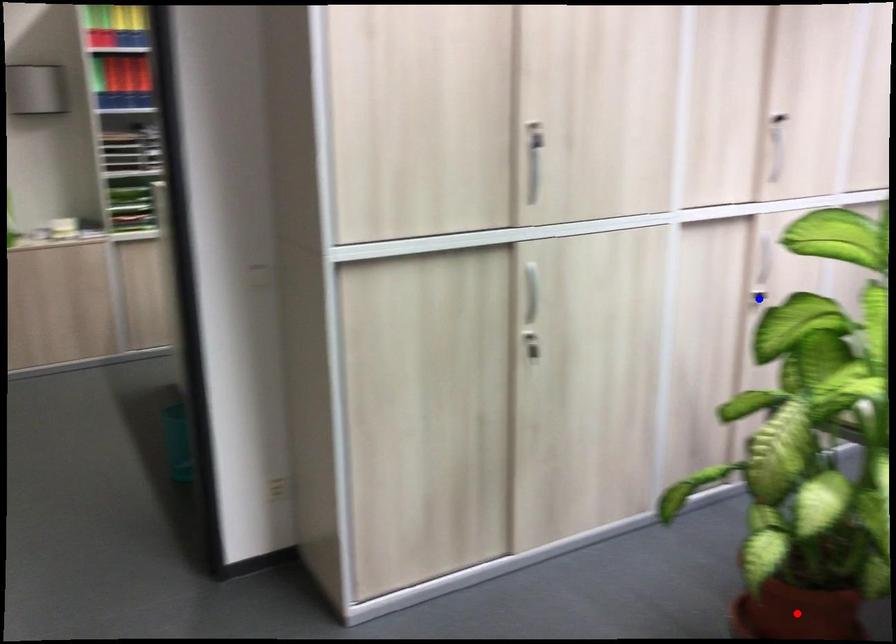
Question: Two points are marked on the image. Which point is closer to the camera?

Choices:
 (A) Blue point is closer.
 (B) Red point is closer.

Answer: (B)